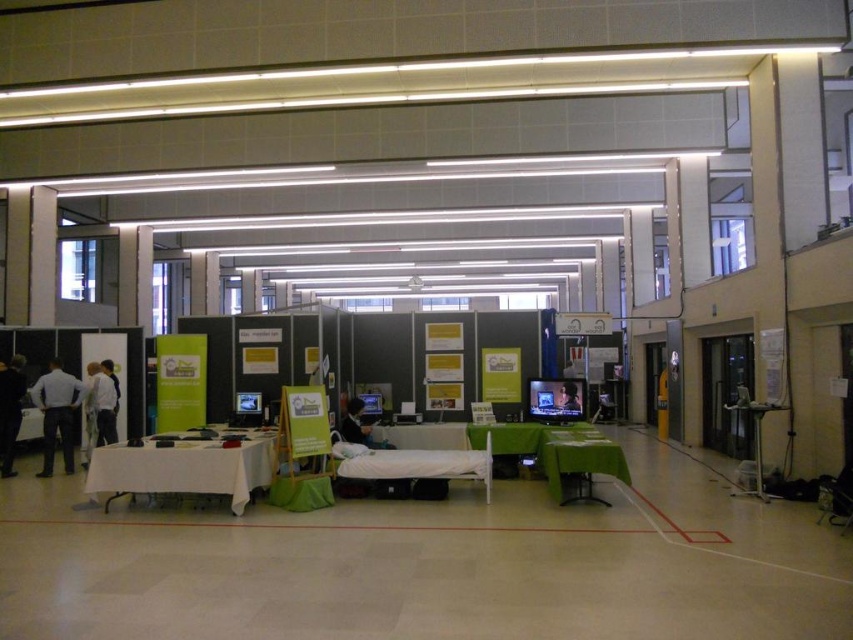
Question: Among these points, which one is farthest from the camera?

Choices:
 (A) (590, 465)
 (B) (570, 403)
 (C) (3, 429)

Answer: (C)

Question: Which of the following is the farthest from the observer?

Choices:
 (A) (102, 467)
 (B) (364, 435)

Answer: (B)

Question: Which object is farther from the camera taking this photo?

Choices:
 (A) green fabric table at center
 (B) white fabric at left
 (C) light blue shirt at left
 (D) shiny black tv at center

Answer: (B)

Question: Is green fabric table at center positioned behind dark blue shirt at center?

Choices:
 (A) yes
 (B) no

Answer: (B)

Question: Does white fabric table at center have a smaller size compared to white fabric at left?

Choices:
 (A) no
 (B) yes

Answer: (A)

Question: Does dark blue shirt at center lie in front of shiny black tv at center?

Choices:
 (A) yes
 (B) no

Answer: (A)